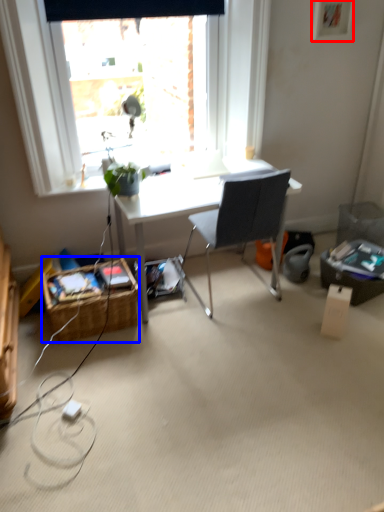
Question: Which object appears closest to the camera in this image, picture frame (highlighted by a red box) or picnic basket (highlighted by a blue box)?

Choices:
 (A) picture frame
 (B) picnic basket

Answer: (B)